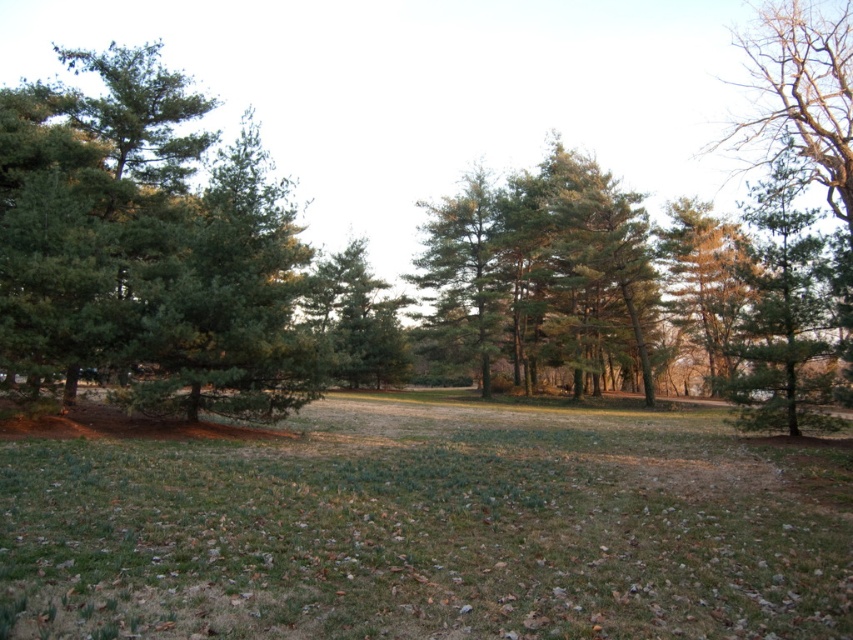
You are a hiker trying to determine which tree is taller between the green matte tree at right and the green matte tree at center. Based on the scene, which one is taller?

The green matte tree at right is taller than the green matte tree at center.

You are standing in the middle of the grassy area and see the green matte tree at right and the green matte tree at center. Which tree is positioned more to the east?

The green matte tree at right is positioned to the right of the green matte tree at center, so if you are facing the scene, the green matte tree at right would be more to the east.

You are standing at the center of the image and want to place a small garden ornament. The ornament requires a spot with green grass at center. According to the coordinates provided, where should you place it?

The green grass at center is located at point (421, 531), so you should place the ornament there.